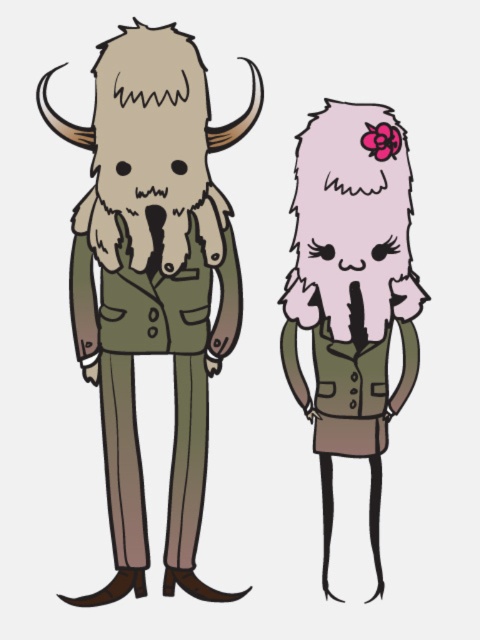
Question: Can you confirm if fuzzy beige fur at left is smaller than pink fluffy fur at right?

Choices:
 (A) yes
 (B) no

Answer: (B)

Question: Is fuzzy beige fur at left above pink fluffy fur at right?

Choices:
 (A) yes
 (B) no

Answer: (A)

Question: Which point is farther to the camera?

Choices:
 (A) fuzzy beige fur at left
 (B) pink fluffy fur at right

Answer: (B)

Question: Considering the relative positions of fuzzy beige fur at left and pink fluffy fur at right in the image provided, where is fuzzy beige fur at left located with respect to pink fluffy fur at right?

Choices:
 (A) above
 (B) below

Answer: (A)

Question: Which point is closer to the camera?

Choices:
 (A) (243, 124)
 (B) (396, 396)

Answer: (A)